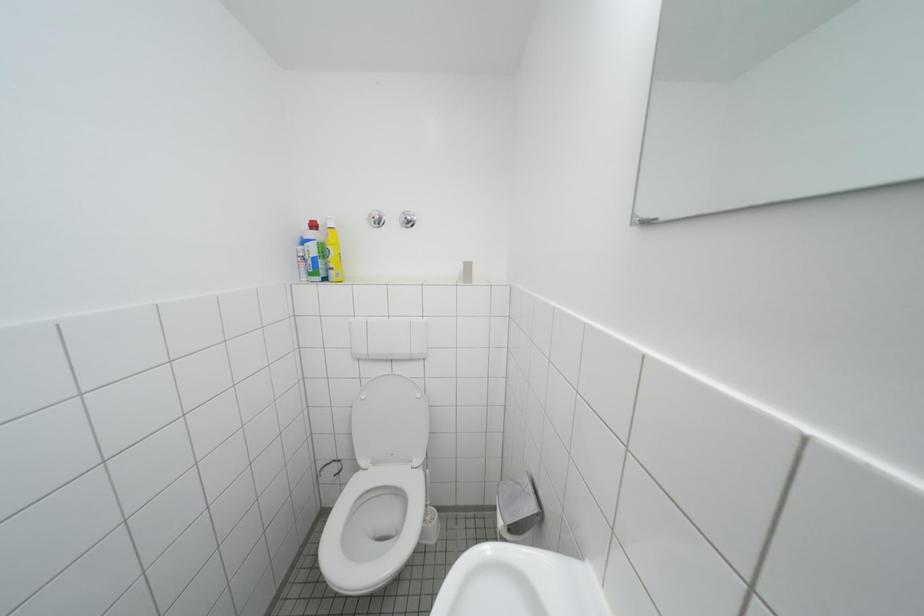
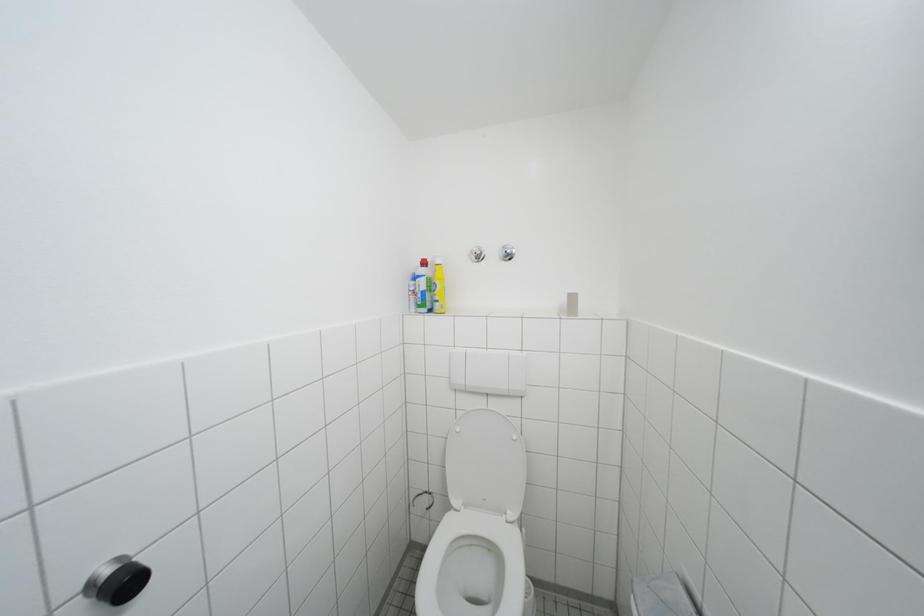
Question: The images are taken continuously from a first-person perspective. In which direction are you moving?

Choices:
 (A) Left
 (B) Right
 (C) Forward
 (D) Backward

Answer: (A)